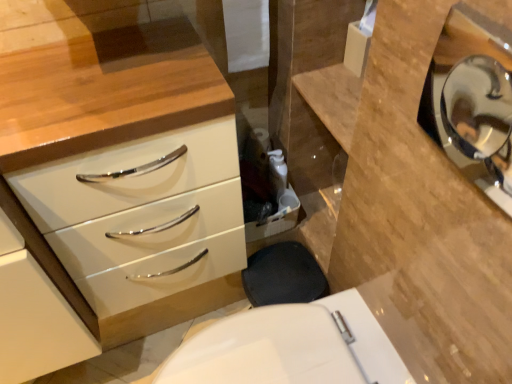
Locate an element on the screen. The height and width of the screenshot is (384, 512). vacant region above white glossy chest of drawers at left (from a real-world perspective) is located at coordinates (89, 92).